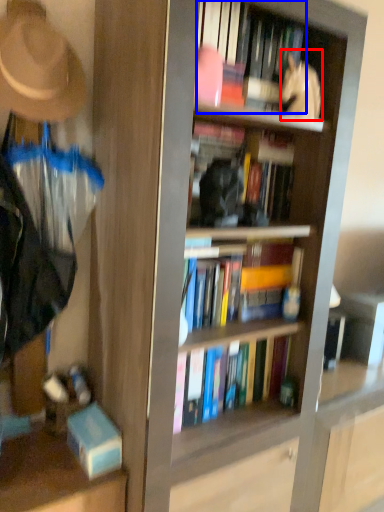
Question: Which object is closer to the camera taking this photo, person (highlighted by a red box) or book (highlighted by a blue box)?

Choices:
 (A) person
 (B) book

Answer: (B)